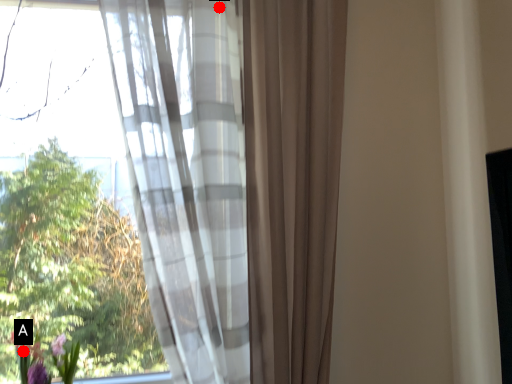
Question: Two points are circled on the image, labeled by A and B beside each circle. Among these points, which one is farthest from the camera?

Choices:
 (A) A is further
 (B) B is further

Answer: (A)